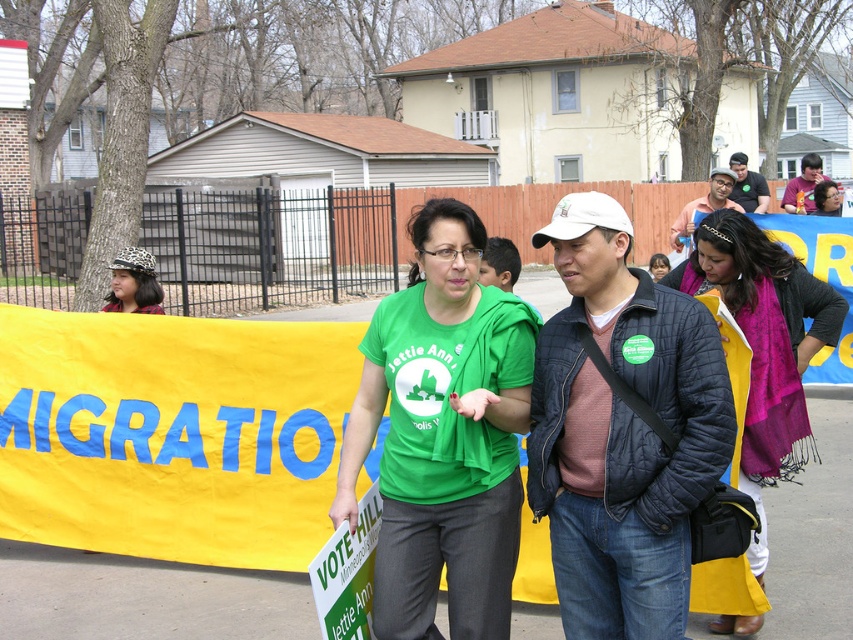
Question: Which point is farther to the camera?

Choices:
 (A) quilted black jacket at center
 (B) matte pink scarf at center

Answer: (B)

Question: Is yellow fabric banner at center to the right of matte black t-shirt at center from the viewer's perspective?

Choices:
 (A) yes
 (B) no

Answer: (B)

Question: From the image, what is the correct spatial relationship of quilted black jacket at center in relation to matte black jacket at center?

Choices:
 (A) below
 (B) above

Answer: (A)

Question: Is yellow fabric banner at center wider than quilted black jacket at center?

Choices:
 (A) yes
 (B) no

Answer: (A)

Question: Among these objects, which one is farthest from the camera?

Choices:
 (A) matte black jacket at center
 (B) matte pink scarf at center

Answer: (B)

Question: Which object is closer to the camera taking this photo?

Choices:
 (A) matte pink scarf at center
 (B) matte black jacket at center

Answer: (B)